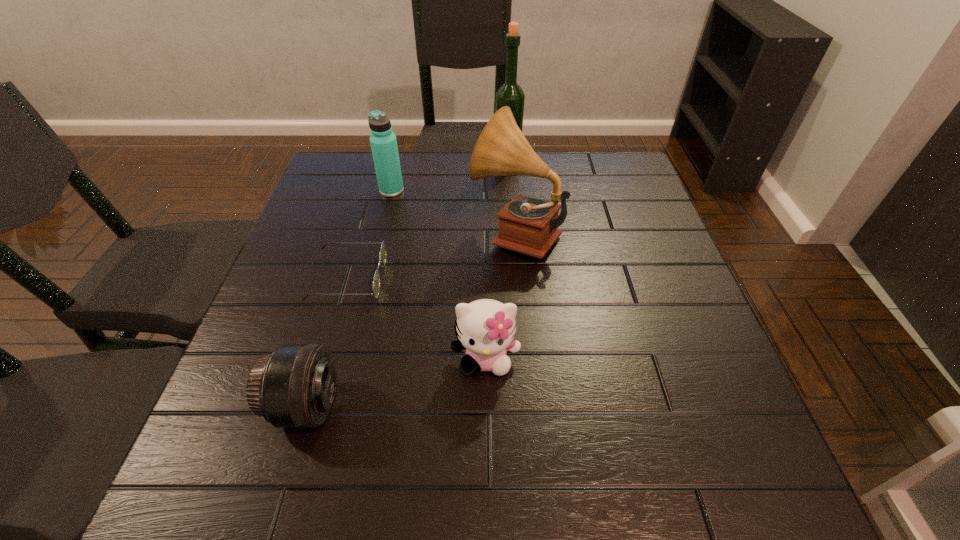
You are a GUI agent. You are given a task and a screenshot of the screen. Output one action in this format:
    pyautogui.click(x=<x>, y=<y>)
    Task: Click on the vacant space in between the telephoto lens and the phonograph record
    This screenshot has width=960, height=540.
    Given the screenshot: What is the action you would take?
    pyautogui.click(x=411, y=319)

You are a GUI agent. You are given a task and a screenshot of the screen. Output one action in this format:
    pyautogui.click(x=<x>, y=<y>)
    Task: Click on the free space between the thermos bottle and the liquor
    
    Given the screenshot: What is the action you would take?
    pyautogui.click(x=449, y=175)

This screenshot has width=960, height=540. Find the location of `vacant point located between the second tallest object and the liquor`. vacant point located between the second tallest object and the liquor is located at coordinates (512, 196).

Locate an element on the screen. free space between the fifth shortest object and the shortest object is located at coordinates (432, 255).

Image resolution: width=960 pixels, height=540 pixels. I want to click on unoccupied position between the fourth shortest object and the liquor, so click(x=449, y=175).

Locate an element on the screen. free space between the sunglasses and the phonograph record is located at coordinates (432, 255).

Where is `free space between the shortest object and the kitten`? free space between the shortest object and the kitten is located at coordinates (417, 318).

In order to click on vacant space that is in between the farthest object and the kitten in this screenshot , I will do `click(496, 259)`.

Select which object is the fourth closest to the shortest object. Please provide its 2D coordinates. Your answer should be formatted as a tuple, i.e. [(x, y)], where the tuple contains the x and y coordinates of a point satisfying the conditions above.

[(383, 141)]

The width and height of the screenshot is (960, 540). In order to click on the closest object to the tallest object in this screenshot , I will do `click(527, 225)`.